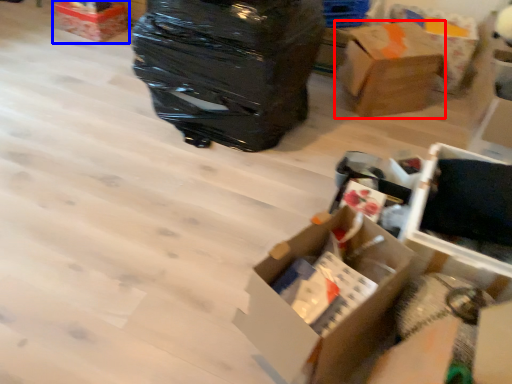
Question: Which of the following is the farthest to the observer, box (highlighted by a red box) or box (highlighted by a blue box)?

Choices:
 (A) box
 (B) box

Answer: (B)